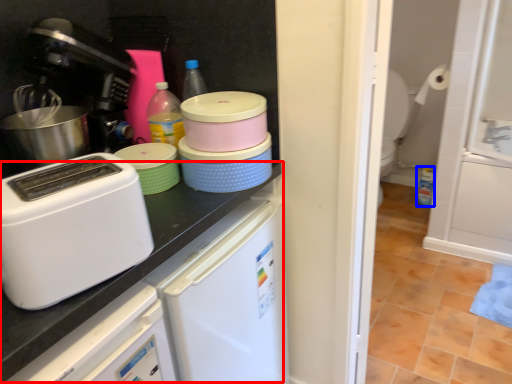
Question: Which object is closer to the camera taking this photo, counter top (highlighted by a red box) or bottle (highlighted by a blue box)?

Choices:
 (A) counter top
 (B) bottle

Answer: (A)